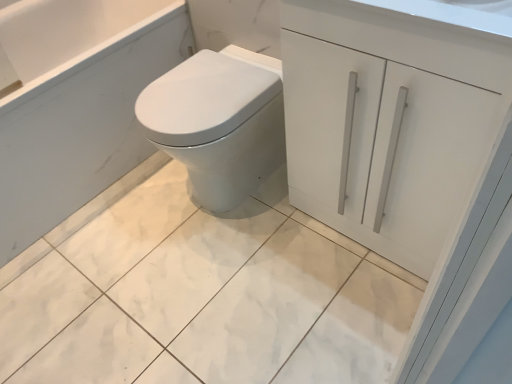
Question: Is white glossy cabinet at upper right not near white glossy bidet at center?

Choices:
 (A) yes
 (B) no

Answer: (B)

Question: Is white glossy cabinet at upper right at the right side of white glossy bidet at center?

Choices:
 (A) yes
 (B) no

Answer: (A)

Question: From a real-world perspective, is white glossy cabinet at upper right beneath white glossy bidet at center?

Choices:
 (A) no
 (B) yes

Answer: (A)

Question: Is white glossy cabinet at upper right next to white glossy bidet at center and touching it?

Choices:
 (A) no
 (B) yes

Answer: (A)

Question: Is white glossy cabinet at upper right wider than white glossy bidet at center?

Choices:
 (A) no
 (B) yes

Answer: (A)

Question: Is white glossy cabinet at upper right inside or outside of white glossy cabinet at upper right?

Choices:
 (A) outside
 (B) inside

Answer: (A)

Question: From the image's perspective, is white glossy cabinet at upper right located above or below white glossy cabinet at upper right?

Choices:
 (A) above
 (B) below

Answer: (B)

Question: Is white glossy cabinet at upper right to the left or to the right of white glossy cabinet at upper right in the image?

Choices:
 (A) right
 (B) left

Answer: (A)

Question: Is point (464, 163) closer or farther from the camera than point (500, 74)?

Choices:
 (A) farther
 (B) closer

Answer: (A)

Question: Considering the positions of white glossy cabinet at upper right and white marble tile at center in the image, is white glossy cabinet at upper right bigger or smaller than white marble tile at center?

Choices:
 (A) small
 (B) big

Answer: (B)

Question: Is point [x=439, y=175] closer or farther from the camera than point [x=375, y=306]?

Choices:
 (A) farther
 (B) closer

Answer: (B)

Question: Is white glossy cabinet at upper right inside or outside of white marble tile at center?

Choices:
 (A) inside
 (B) outside

Answer: (B)

Question: Is white glossy cabinet at upper right taller or shorter than white marble tile at center?

Choices:
 (A) tall
 (B) short

Answer: (A)

Question: Is white glossy bidet at center inside the boundaries of white glossy cabinet at upper right, or outside?

Choices:
 (A) inside
 (B) outside

Answer: (B)

Question: Based on their positions, is white glossy bidet at center located to the left or right of white glossy cabinet at upper right?

Choices:
 (A) right
 (B) left

Answer: (B)